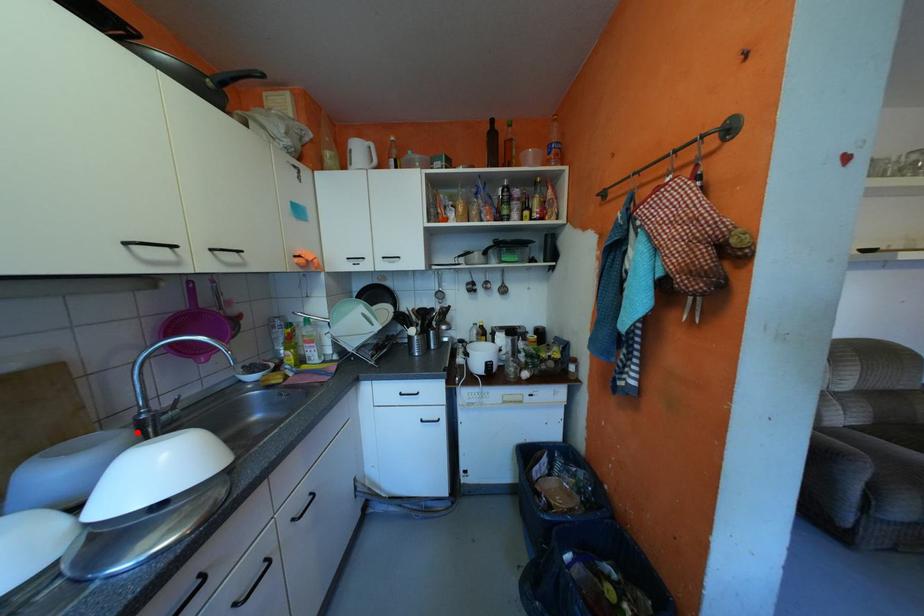
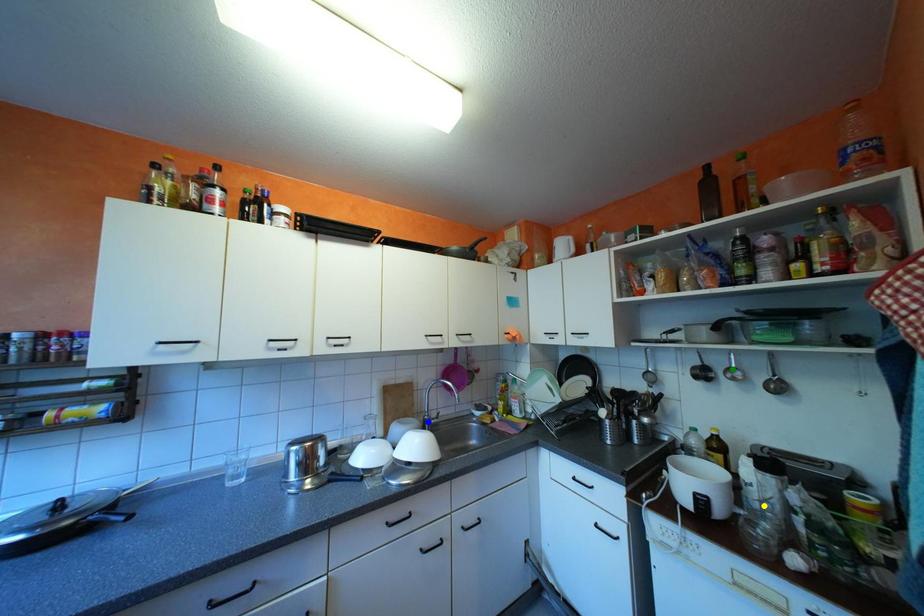
Question: I am providing you with two images of the same scene from different viewpoints. A red point is marked on the first image. You are given multiple points on the second image. Which mark in image 2 goes with the point in image 1?

Choices:
 (A) yellow point
 (B) green point
 (C) blue point

Answer: (C)